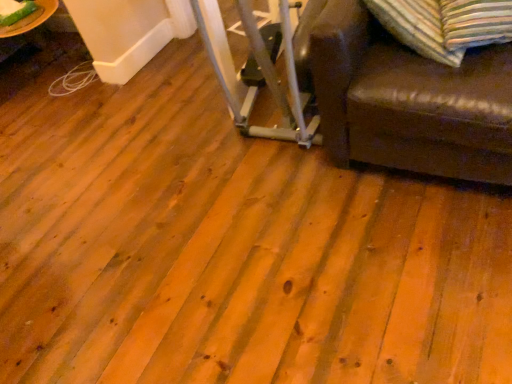
The width and height of the screenshot is (512, 384). Identify the location of vacant space underneath green glass plate at upper left (from a real-world perspective). (18, 11).